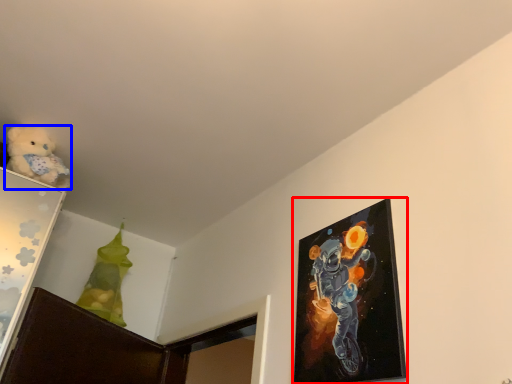
Question: Which point is further to the camera, picture frame (highlighted by a red box) or teddy bear (highlighted by a blue box)?

Choices:
 (A) picture frame
 (B) teddy bear

Answer: (B)